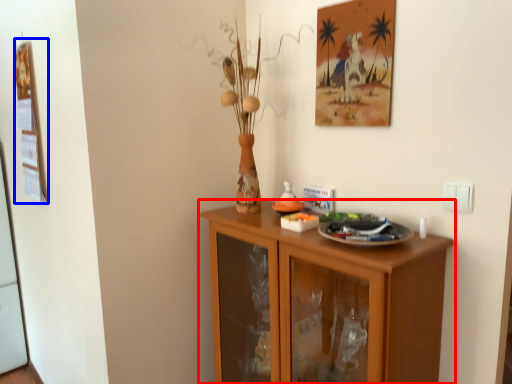
Question: Among these objects, which one is farthest to the camera, cabinetry (highlighted by a red box) or picture frame (highlighted by a blue box)?

Choices:
 (A) cabinetry
 (B) picture frame

Answer: (B)